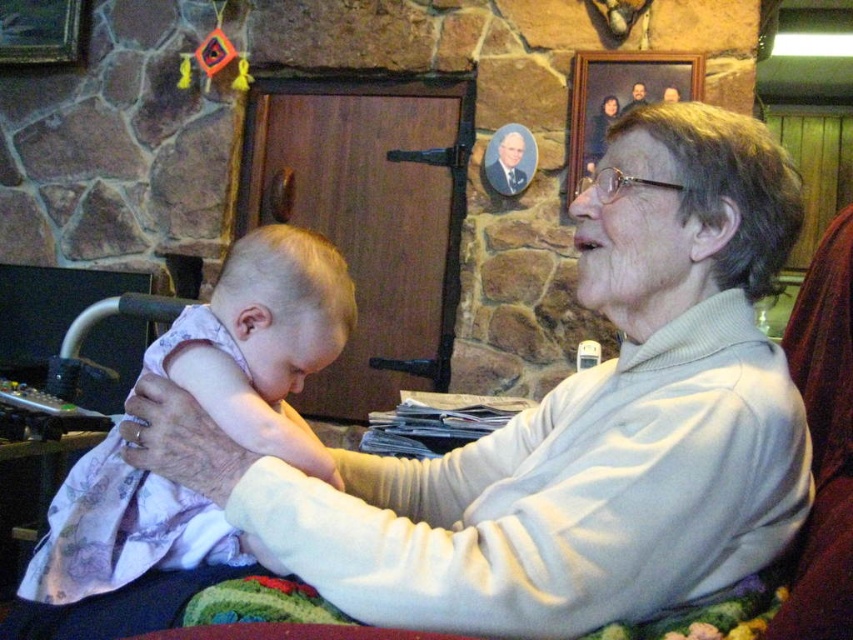
Question: Which object appears closest to the camera in this image?

Choices:
 (A) light pink fabric at center
 (B) white sweater at center

Answer: (B)

Question: Among these points, which one is farthest from the camera?

Choices:
 (A) (549, 472)
 (B) (273, 276)

Answer: (B)

Question: Where is white sweater at center located in relation to light pink fabric at center in the image?

Choices:
 (A) left
 (B) right

Answer: (B)

Question: Which point is farther to the camera?

Choices:
 (A) (114, 429)
 (B) (177, 426)

Answer: (A)

Question: Is white sweater at center bigger than light pink fabric at center?

Choices:
 (A) yes
 (B) no

Answer: (A)

Question: Can you confirm if white sweater at center is positioned above light pink fabric at center?

Choices:
 (A) yes
 (B) no

Answer: (A)